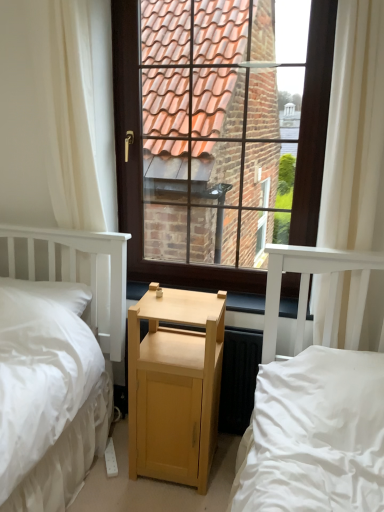
The height and width of the screenshot is (512, 384). Identify the location of free space to the left of light wood nightstand at center. (111, 474).